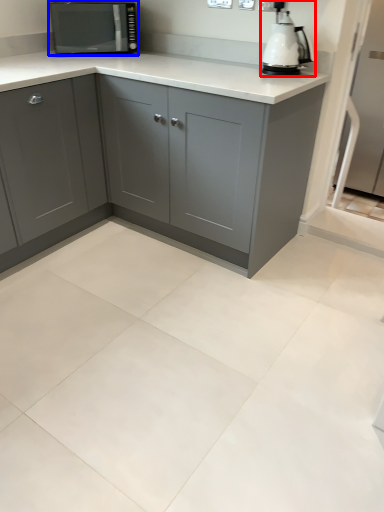
Question: Which of the following is the farthest to the observer, home appliance (highlighted by a red box) or kitchen appliance (highlighted by a blue box)?

Choices:
 (A) home appliance
 (B) kitchen appliance

Answer: (B)